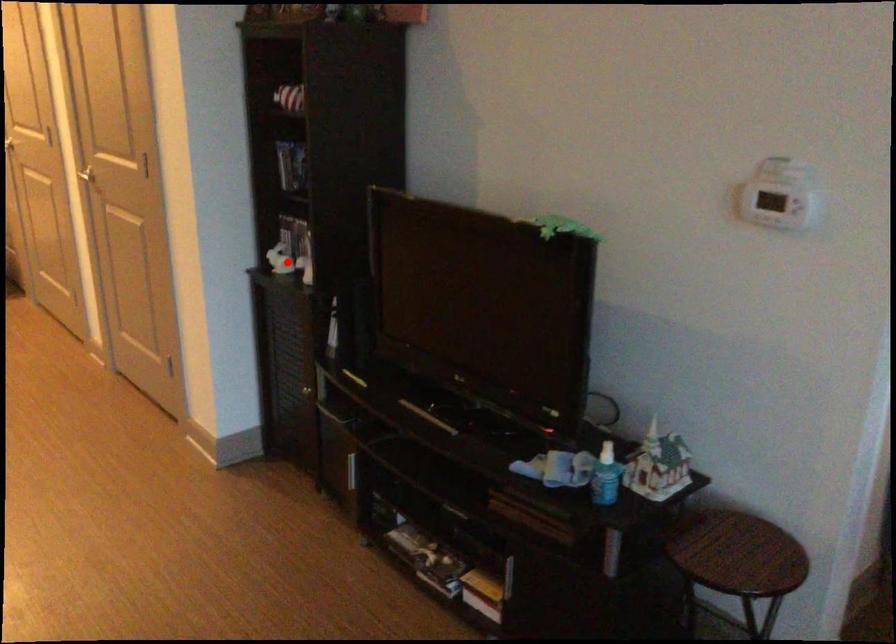
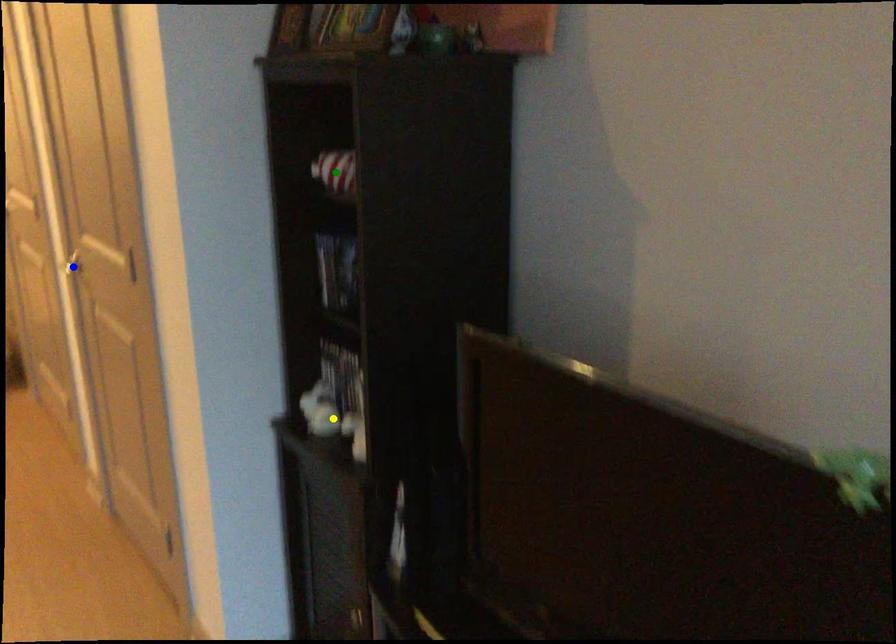
Question: I am providing you with two images of the same scene from different viewpoints. A red point is marked on the first image. You are given multiple points on the second image. Which point in image 2 is actually the same real-world point as the red point in image 1?

Choices:
 (A) green point
 (B) blue point
 (C) yellow point

Answer: (C)